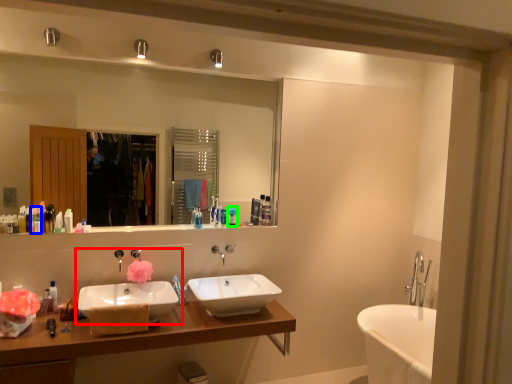
Question: Based on their relative distances, which object is farther from sink (highlighted by a red box)? Choose from toiletry (highlighted by a blue box) and toiletry (highlighted by a green box).

Choices:
 (A) toiletry
 (B) toiletry

Answer: (B)